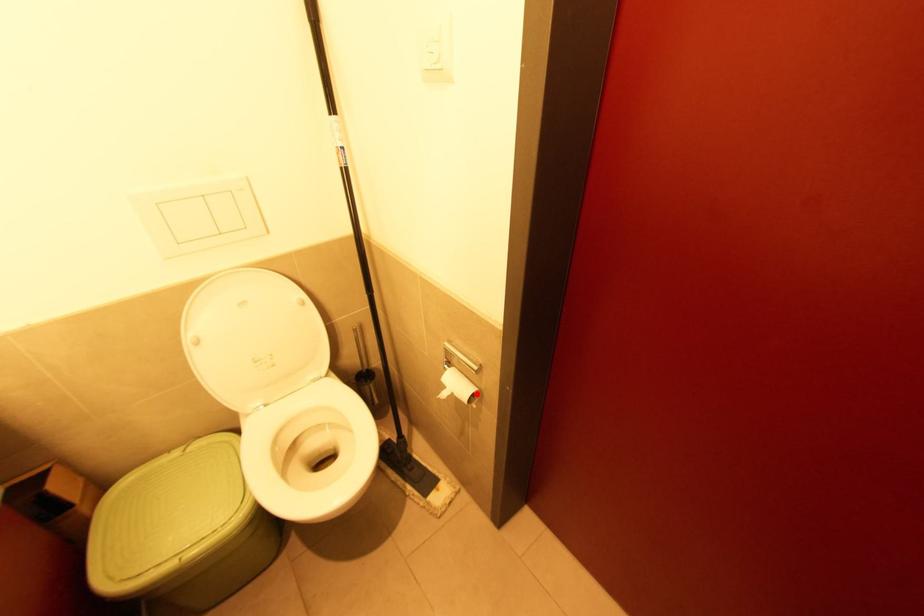
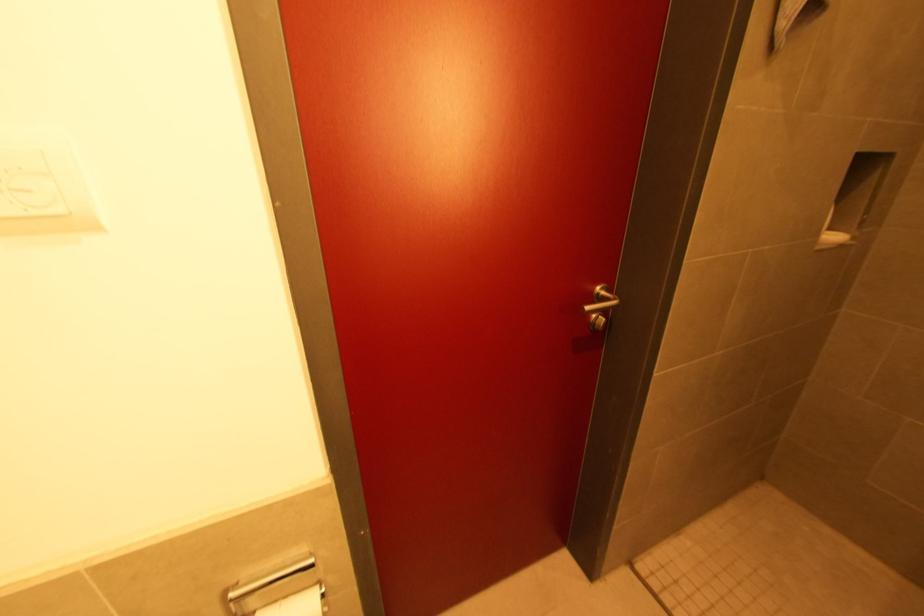
The point at the highlighted location is marked in the first image. Where is the corresponding point in the second image?

(323, 591)